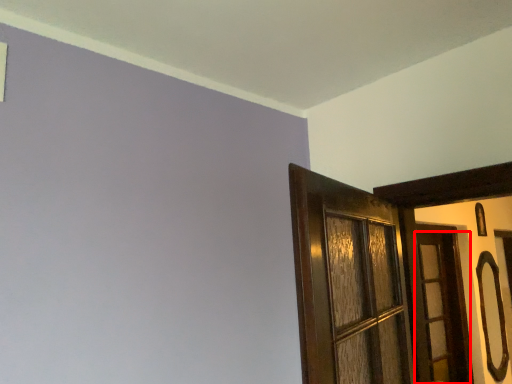
Question: From the image's perspective, considering the relative positions of door (annotated by the red box) and door handle in the image provided, where is door (annotated by the red box) located with respect to the staircase?

Choices:
 (A) above
 (B) below

Answer: (A)